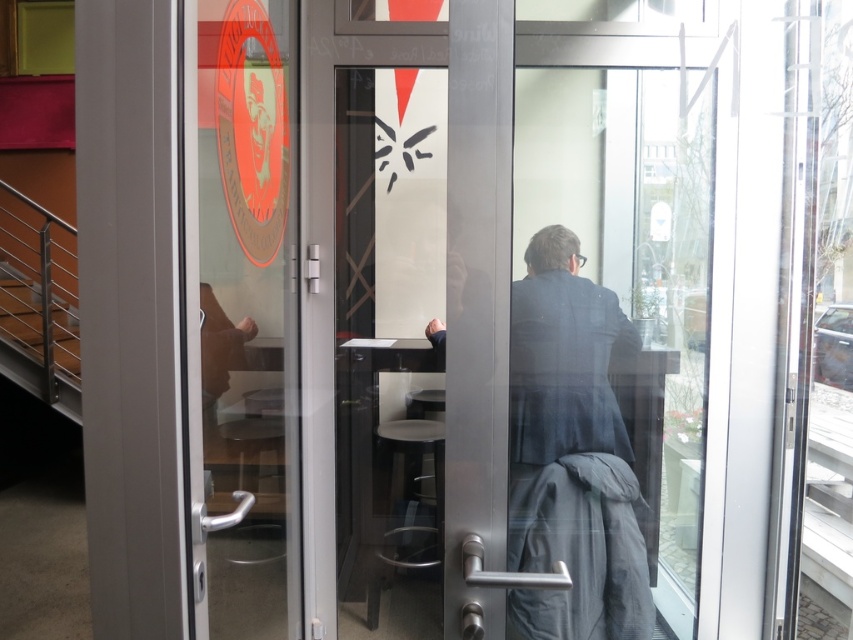
You are a delivery person trying to enter the restaurant. You see the transparent glass door at left and the gray woolen robe at center. Which object is closer to the entrance from your perspective?

The transparent glass door at left is closer to the entrance from your perspective because it is positioned on the left side of the gray woolen robe at center, meaning it is nearer to the entrance area.

You are a delivery person trying to enter the restaurant through the transparent glass door at left. However, you are carrying a large box that is as tall as the gray woolen robe at center. Will the box fit through the door without being too tall?

The transparent glass door at left has a greater height compared to the gray woolen robe at center. Since the box is as tall as the robe, it should fit through the door as the door is taller than the robe.

You are a delivery person trying to enter the restaurant. You see the transparent glass door at left and the gray woolen robe at center. Which object is bigger in size?

The transparent glass door at left has a larger size compared to the gray woolen robe at center, so the transparent glass door at left is bigger.